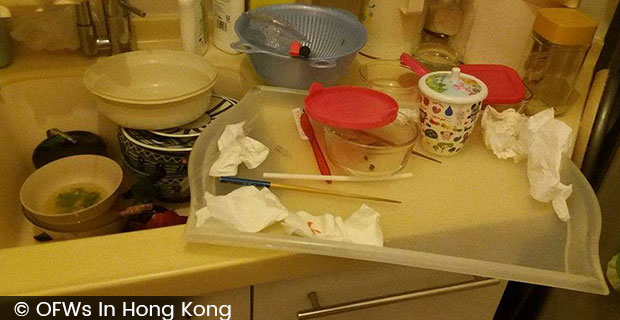
You are a GUI agent. You are given a task and a screenshot of the screen. Output one action in this format:
    pyautogui.click(x=<x>, y=<y>)
    Task: Click on the lid to the glass bowl
    This screenshot has height=320, width=620.
    Given the screenshot: What is the action you would take?
    pyautogui.click(x=358, y=106)